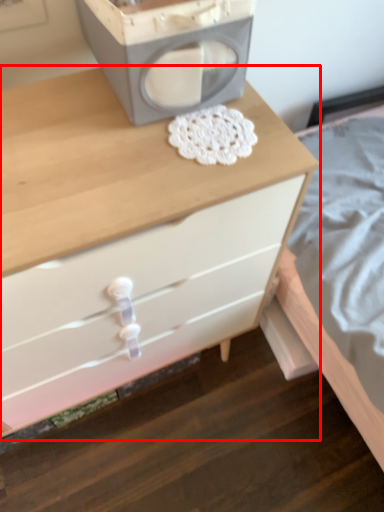
Question: From the image's perspective, what is the correct spatial positioning of chest of drawers (annotated by the red box) in reference to appliance?

Choices:
 (A) below
 (B) above

Answer: (A)